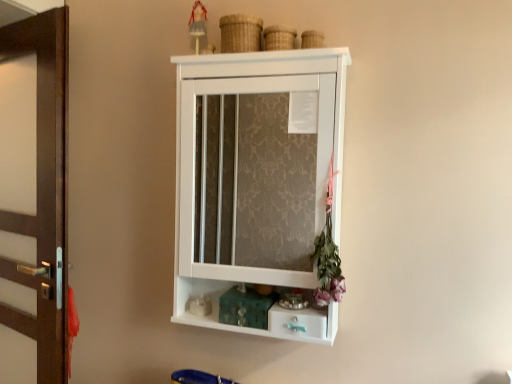
Question: Is point (295, 322) closer or farther from the camera than point (55, 142)?

Choices:
 (A) farther
 (B) closer

Answer: (B)

Question: From the image's perspective, relative to brown wood door at left, is teal glossy drawer at lower center above or below?

Choices:
 (A) above
 (B) below

Answer: (B)

Question: Estimate the real-world distances between objects in this image. Which object is farther from the white matte figurine at lower center, the first toy positioned from the bottom?

Choices:
 (A) brown wood door at left
 (B) purple fabric flower at right
 (C) white matte cabinet at center
 (D) matte plastic doll at upper center, the second toy when ordered from bottom to top
 (E) teal glossy drawer at lower center

Answer: (C)

Question: Which is nearer to the white matte cabinet at center?

Choices:
 (A) matte plastic doll at upper center, acting as the first toy starting from the top
 (B) brown wood door at left
 (C) teal glossy drawer at lower center
 (D) white matte figurine at lower center, placed as the 2th toy when sorted from top to bottom
 (E) purple fabric flower at right

Answer: (B)